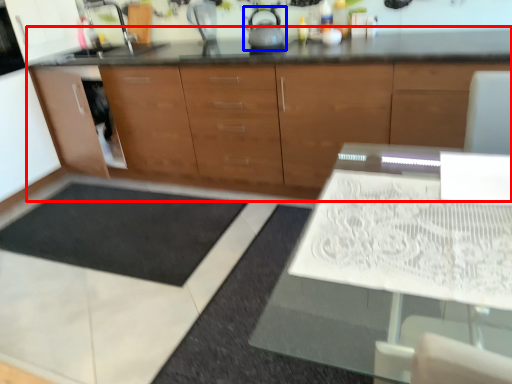
Question: Which object is closer to the camera taking this photo, cabinetry (highlighted by a red box) or tea pot (highlighted by a blue box)?

Choices:
 (A) cabinetry
 (B) tea pot

Answer: (A)